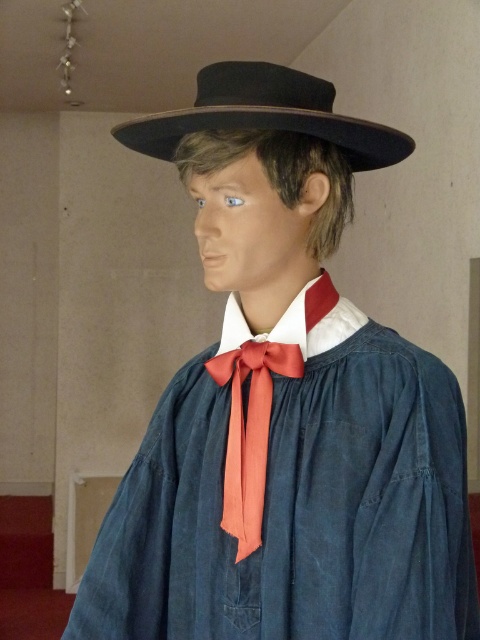
You are a tailor measuring the distance between the black felt fedora at upper center and the satin orange bow tie at center for a custom accessory. The minimum required distance for proper fitting is 12 inches. Can the accessory be safely attached without overlapping?

The black felt fedora at upper center is 13.08 inches from the satin orange bow tie at center, which exceeds the minimum required distance of 12 inches. Therefore, the accessory can be safely attached without overlapping.

You are a tailor examining the mannequin and need to adjust the black felt fedora at upper center and the satin orange bow tie at center. Which item is positioned closer to your current viewpoint?

The black felt fedora at upper center is closer to the viewer than the satin orange bow tie at center.